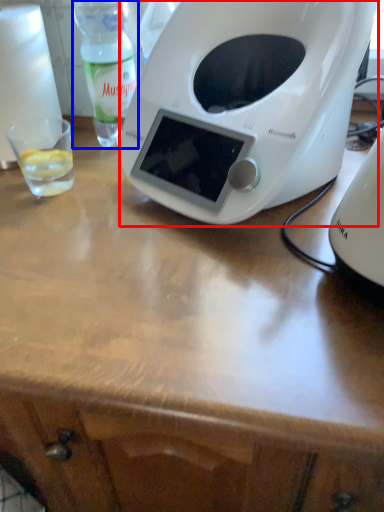
Question: Which point is further to the camera, toaster (highlighted by a red box) or bottle (highlighted by a blue box)?

Choices:
 (A) toaster
 (B) bottle

Answer: (B)